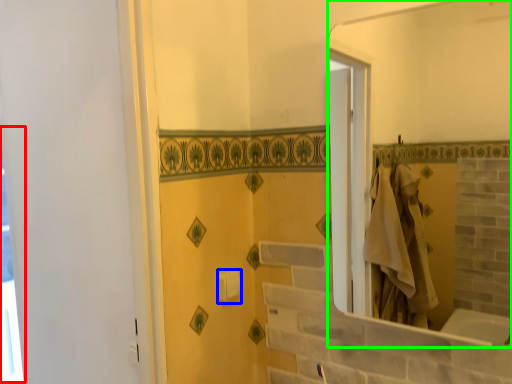
Question: Which is farther away from window (highlighted by a red box)? towel bar (highlighted by a blue box) or mirror (highlighted by a green box)?

Choices:
 (A) towel bar
 (B) mirror

Answer: (B)